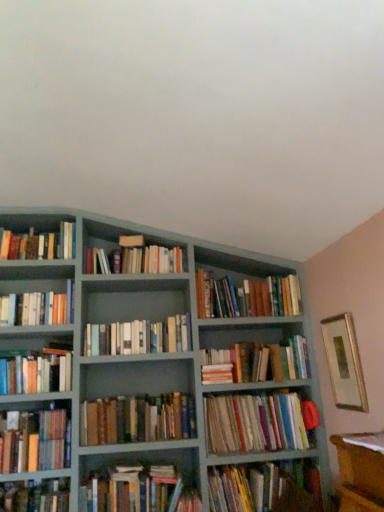
Question: Is hardcover books at lower left, arranged as the fifth book when ordered from the bottom, oriented away from hardcover books at left, which ranks as the seventh book in bottom-to-top order?

Choices:
 (A) no
 (B) yes

Answer: (A)

Question: From a real-world perspective, does hardcover books at lower left, the ninth book in the top-to-bottom sequence, stand above hardcover books at left, which ranks as the seventh book in bottom-to-top order?

Choices:
 (A) no
 (B) yes

Answer: (A)

Question: Does hardcover books at lower left, the ninth book in the top-to-bottom sequence, lie behind hardcover books at left, which ranks as the seventh book in bottom-to-top order?

Choices:
 (A) yes
 (B) no

Answer: (B)

Question: Does hardcover books at lower left, the ninth book in the top-to-bottom sequence, have a larger size compared to hardcover books at left, which ranks as the seventh book in bottom-to-top order?

Choices:
 (A) yes
 (B) no

Answer: (B)

Question: From a real-world perspective, is hardcover books at lower left, the ninth book in the top-to-bottom sequence, under hardcover books at left, which ranks as the seventh book in bottom-to-top order?

Choices:
 (A) no
 (B) yes

Answer: (B)

Question: Are hardcover books at lower left, arranged as the fifth book when ordered from the bottom, and hardcover books at left, which ranks as the seventh book in bottom-to-top order, located far from each other?

Choices:
 (A) yes
 (B) no

Answer: (B)

Question: Does hardcover books at upper left, which is counted as the 13th book, starting from the bottom, have a greater width compared to multicolored paperbacks at center, which is counted as the tenth book, starting from the top?

Choices:
 (A) no
 (B) yes

Answer: (A)

Question: Can you see hardcover books at upper left, which is counted as the 1th book, starting from the top, touching multicolored paperbacks at center, the 4th book positioned from the bottom?

Choices:
 (A) yes
 (B) no

Answer: (B)

Question: Is hardcover books at upper left, which is counted as the 13th book, starting from the bottom, to the right of multicolored paperbacks at center, the 4th book positioned from the bottom, from the viewer's perspective?

Choices:
 (A) yes
 (B) no

Answer: (B)

Question: Is hardcover books at upper left, which is counted as the 1th book, starting from the top, oriented away from multicolored paperbacks at center, the 4th book positioned from the bottom?

Choices:
 (A) yes
 (B) no

Answer: (B)

Question: Can you confirm if hardcover books at upper left, which is counted as the 13th book, starting from the bottom, is bigger than multicolored paperbacks at center, which is counted as the tenth book, starting from the top?

Choices:
 (A) yes
 (B) no

Answer: (B)

Question: Is hardcover books at upper left, which is counted as the 13th book, starting from the bottom, smaller than multicolored paperbacks at center, the 4th book positioned from the bottom?

Choices:
 (A) no
 (B) yes

Answer: (B)

Question: From the image's perspective, is hardcover books at center, positioned as the ninth book in bottom-to-top order, above multicolored paperbacks at center, the 4th book positioned from the bottom?

Choices:
 (A) no
 (B) yes

Answer: (B)